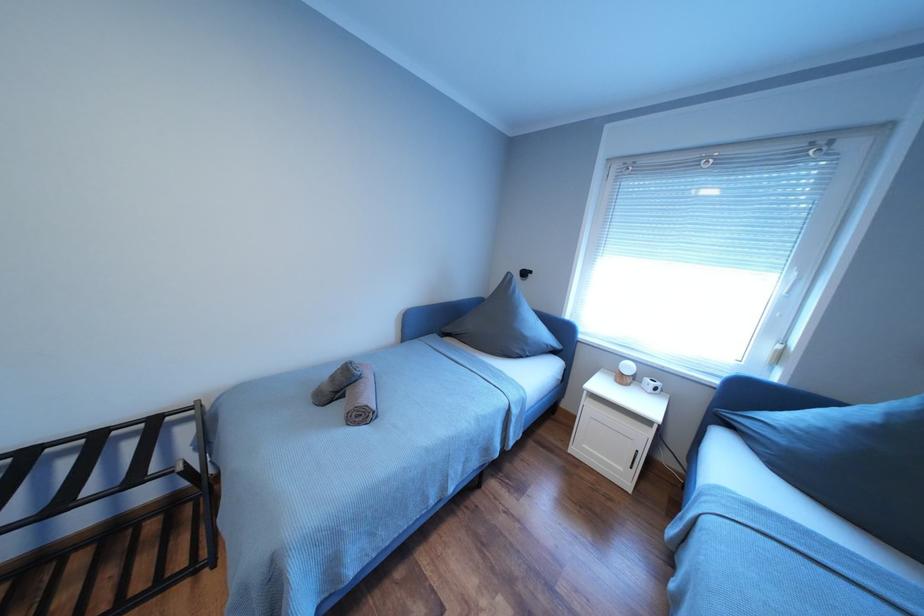
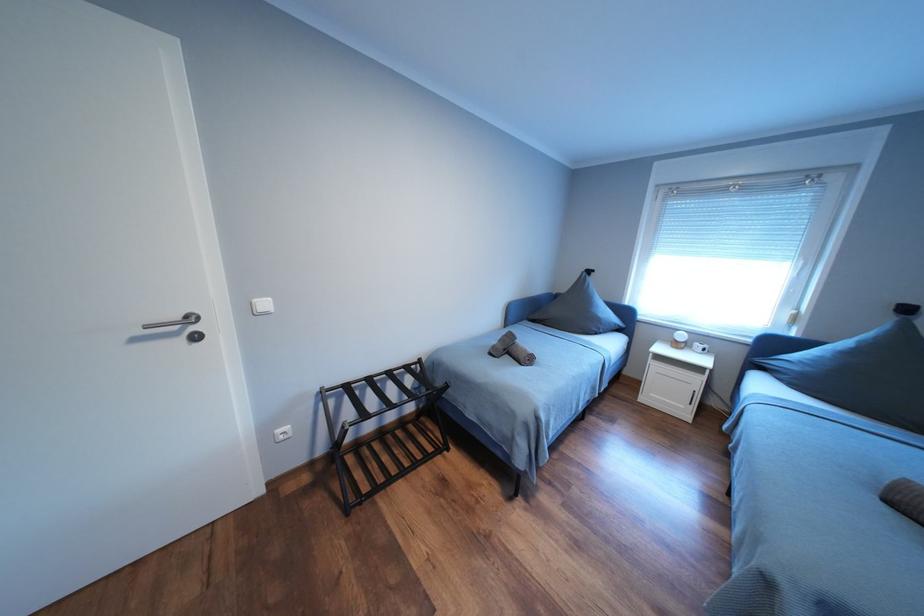
In a continuous first-person perspective shot, in which direction is the camera moving?

The movement direction of the cameraman is left, backward.